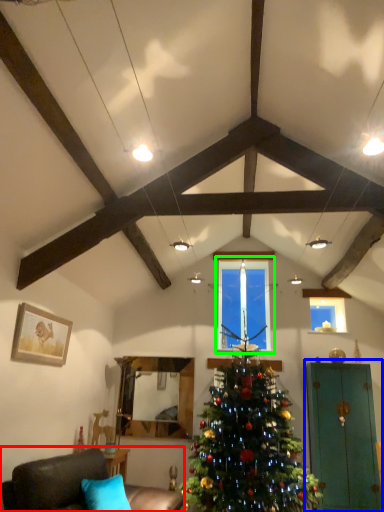
Question: Based on their relative distances, which object is nearer to studio couch (highlighted by a red box)? Choose from armoire (highlighted by a blue box) and window (highlighted by a green box).

Choices:
 (A) armoire
 (B) window

Answer: (B)